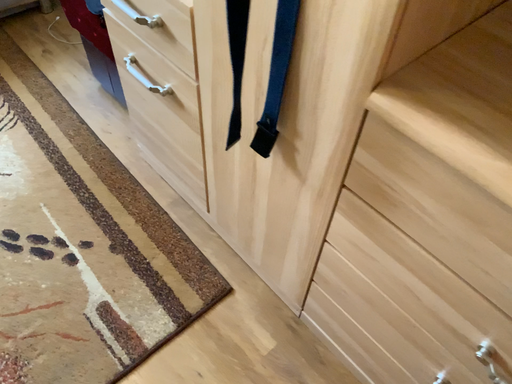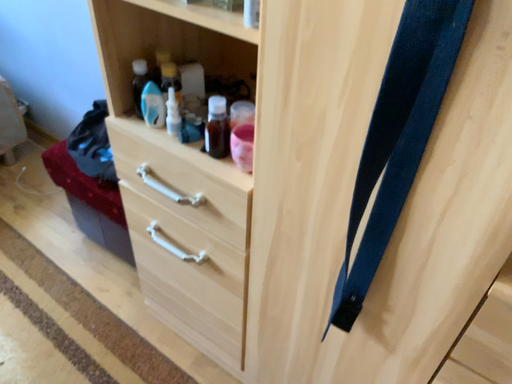
Question: How did the camera likely rotate when shooting the video?

Choices:
 (A) rotated downward
 (B) rotated upward

Answer: (B)